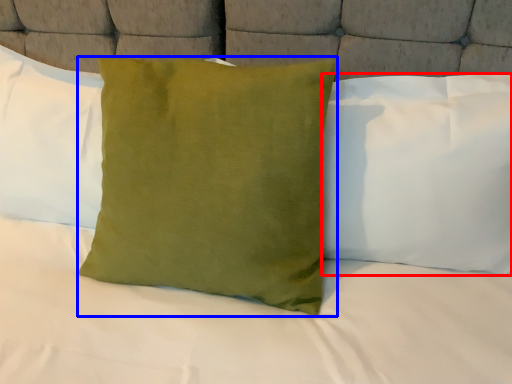
Question: Which object is closer to the camera taking this photo, pillow (highlighted by a red box) or pillow (highlighted by a blue box)?

Choices:
 (A) pillow
 (B) pillow

Answer: (B)